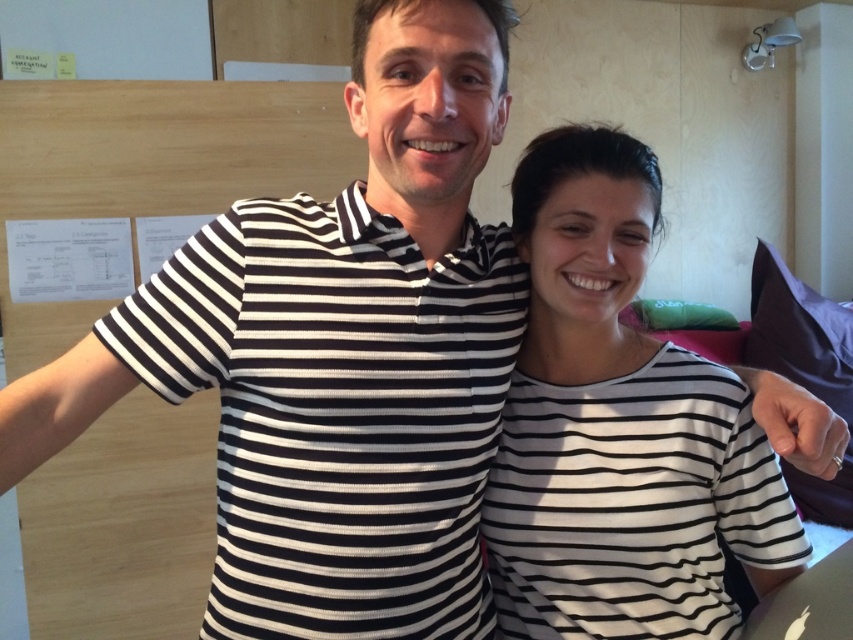
Is black striped polo shirt at center taller than white striped shirt at center?

In fact, black striped polo shirt at center may be shorter than white striped shirt at center.

This screenshot has width=853, height=640. In order to click on black striped polo shirt at center in this screenshot , I will do `click(337, 412)`.

Find the location of a particular element. The height and width of the screenshot is (640, 853). black striped polo shirt at center is located at coordinates (337, 412).